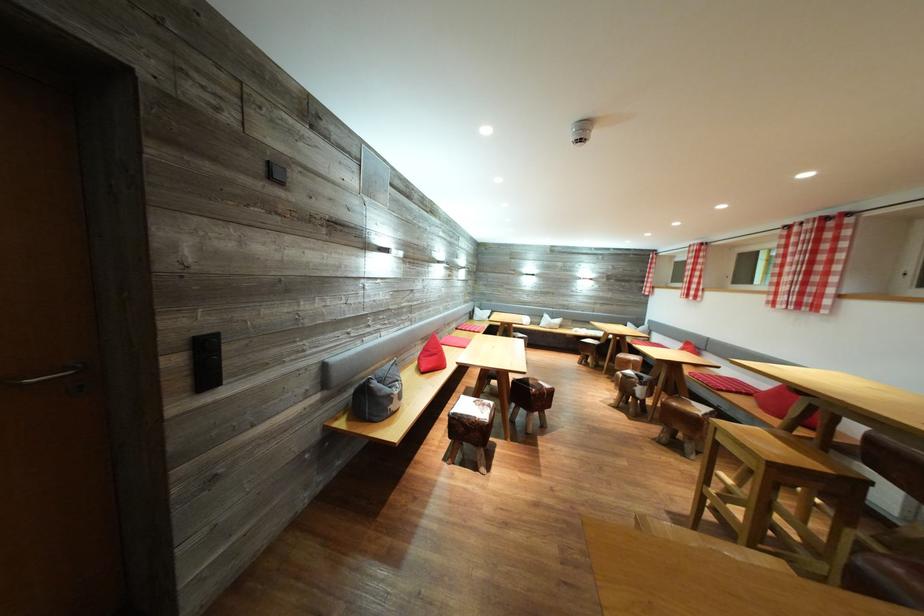
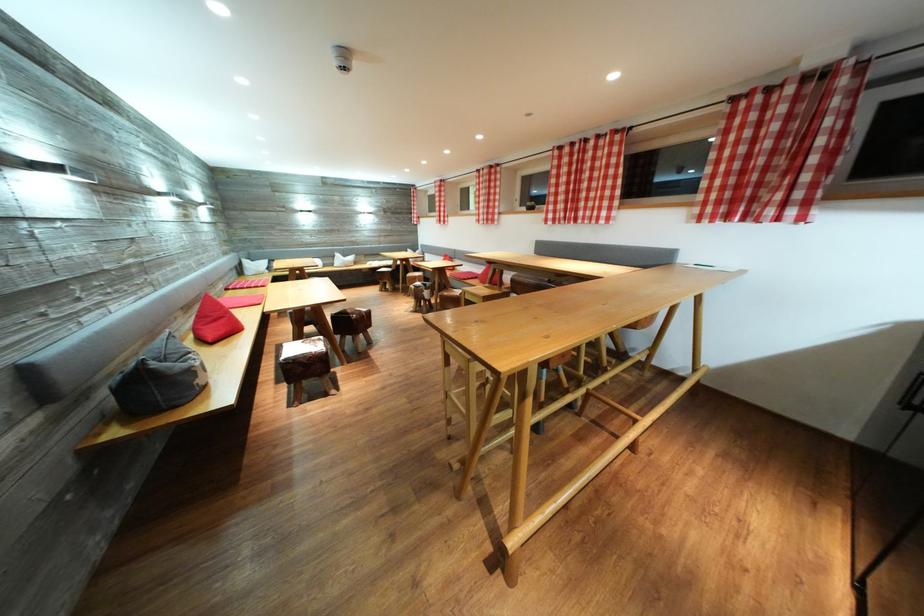
Locate, in the second image, the point that corresponds to pixel 432 355 in the first image.

(207, 323)